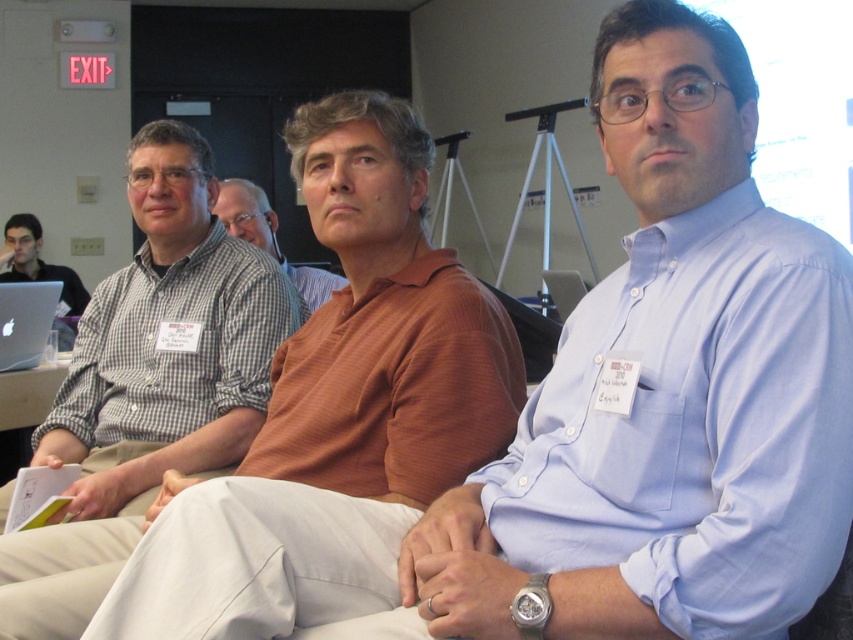
You are organizing a photo shoot and need to arrange the brown matte shirt at center and the matte black laptop at left in a row from thinnest to thickest. Based on the scene, which order should they be placed?

The brown matte shirt at center is thinner than the matte black laptop at left, so the order should be brown matte shirt at center first, followed by the matte black laptop at left.

Looking at this image, you are organizing a presentation and need to decide where to place a new projector. The projector requires a surface that is taller than the brown matte shirt at center. Can the matte black laptop at left provide a suitable surface for the projector?

The brown matte shirt at center is not as tall as the matte black laptop at left, so the matte black laptop at left is taller than the brown matte shirt at center. Therefore, the matte black laptop at left can provide a suitable surface for the projector since it meets the height requirement.